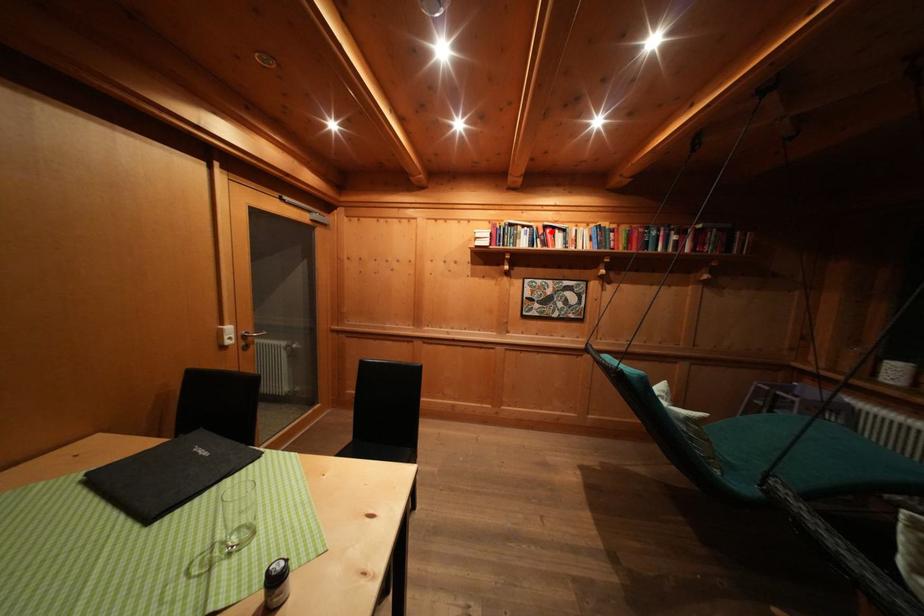
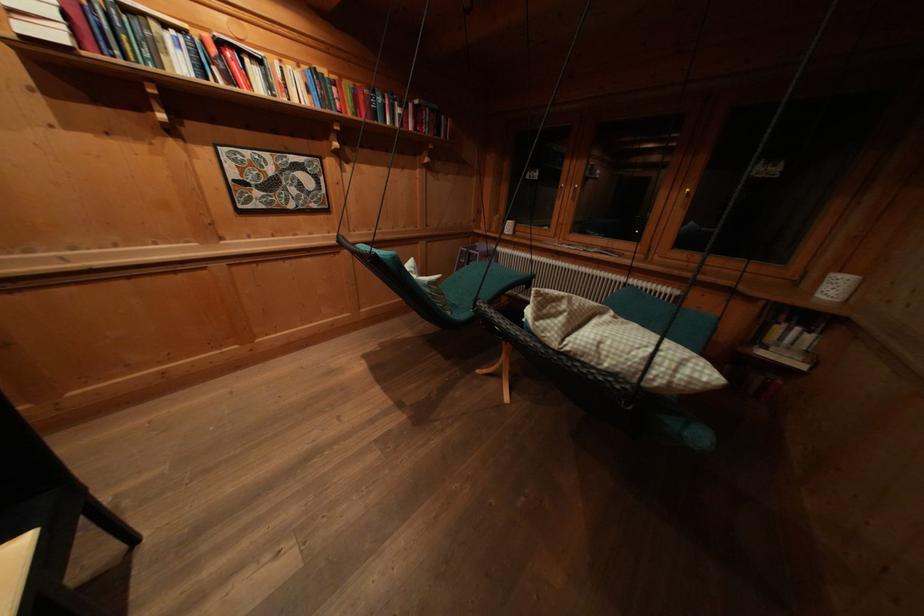
Question: I am providing you with two images of the same scene from different viewpoints. A red point is shown in image1. For the corresponding object point in image2, is it positioned nearer or farther from the camera?

Choices:
 (A) Nearer
 (B) Farther

Answer: (B)